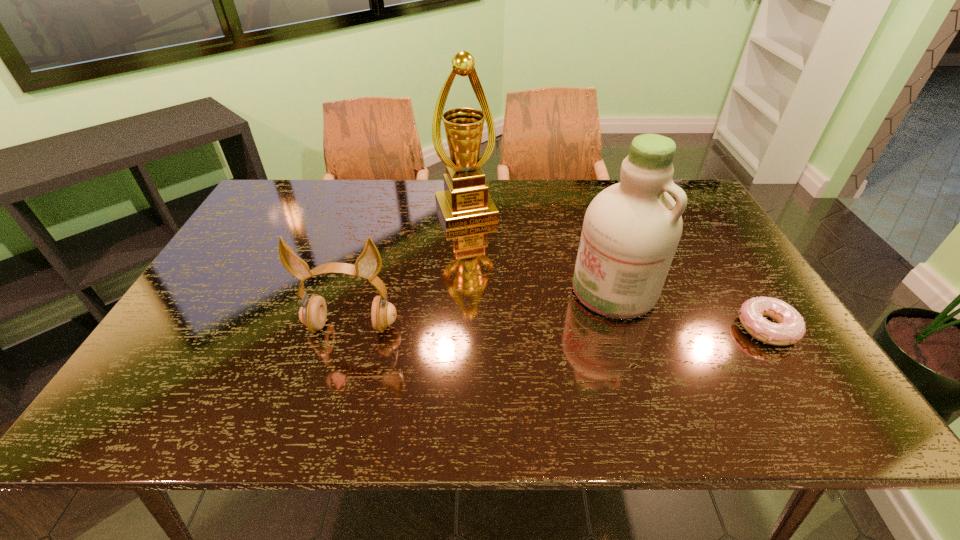
Locate an element on the screen. The width and height of the screenshot is (960, 540). blank space located on the front-facing side of the award is located at coordinates (516, 320).

Where is `free space located on the front-facing side of the award`? The image size is (960, 540). free space located on the front-facing side of the award is located at coordinates (485, 253).

Find the location of a particular element. The width and height of the screenshot is (960, 540). vacant area located 0.280m on the front-facing side of the award is located at coordinates (502, 291).

This screenshot has width=960, height=540. Identify the location of vacant space situated on the front label of the cleansing agent. (531, 337).

Find the location of a particular element. The height and width of the screenshot is (540, 960). vacant region located on the front label of the cleansing agent is located at coordinates (554, 325).

Find the location of a particular element. The image size is (960, 540). free space located on the front label of the cleansing agent is located at coordinates (493, 359).

Where is `object positioned at the far edge`? Image resolution: width=960 pixels, height=540 pixels. object positioned at the far edge is located at coordinates (465, 201).

Identify the location of object that is at the near edge. (790, 329).

Where is `object located in the right edge section of the desktop`? This screenshot has width=960, height=540. object located in the right edge section of the desktop is located at coordinates (790, 329).

Identify the location of object present at the near right corner. The width and height of the screenshot is (960, 540). (790, 329).